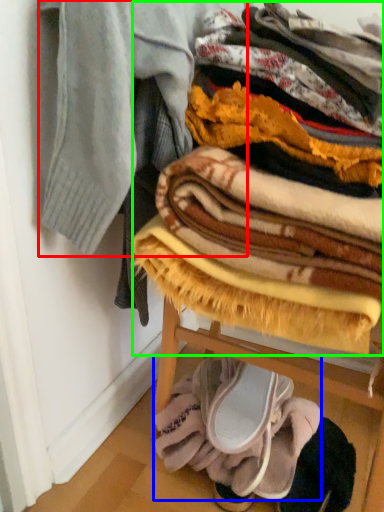
Question: Considering the real-world distances, which object is farthest from garment (highlighted by a red box)? blanket (highlighted by a blue box) or blanket (highlighted by a green box)?

Choices:
 (A) blanket
 (B) blanket

Answer: (A)